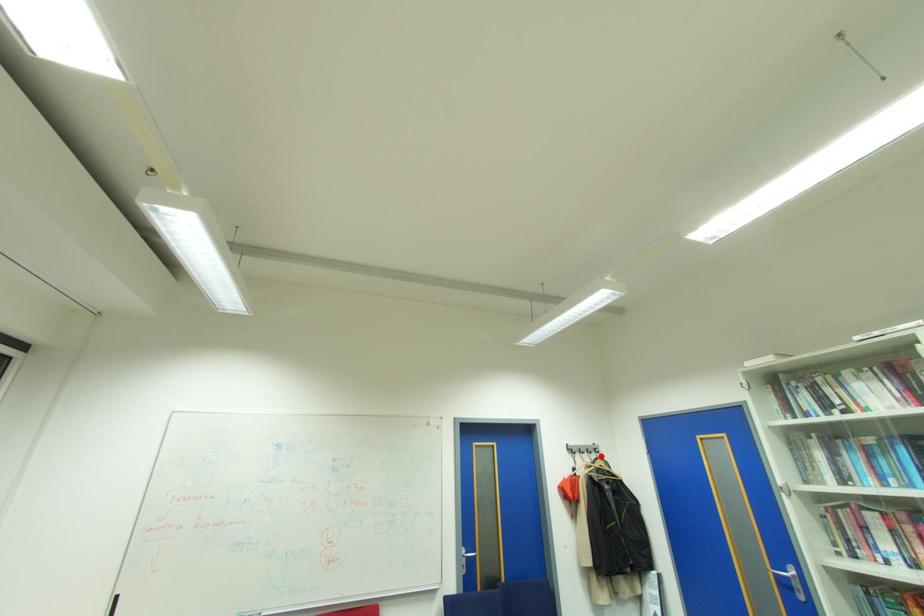
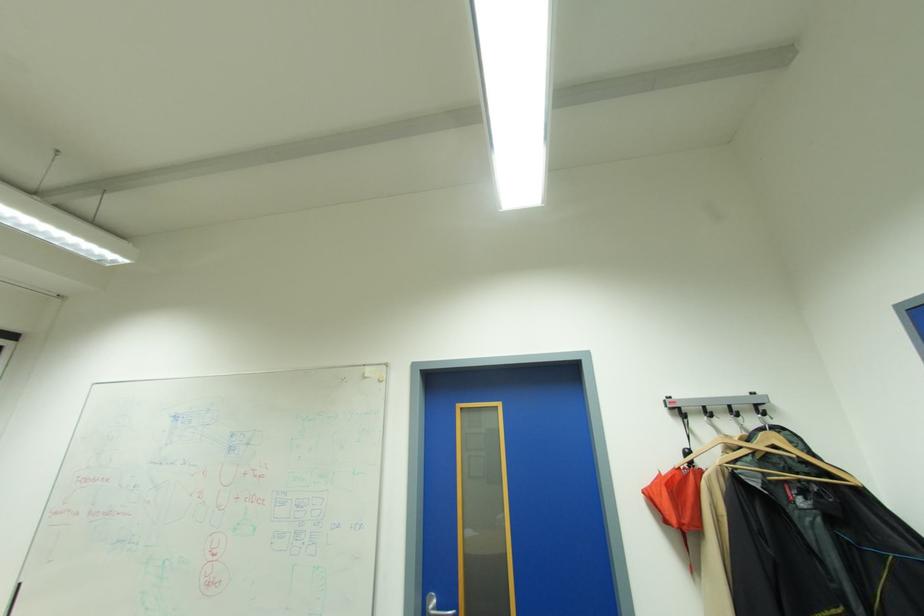
Locate, in the second image, the point that corresponds to the highlighted location in the first image.

(768, 421)